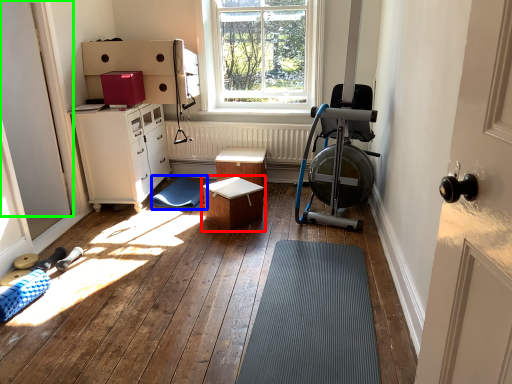
Question: Which object is positioned farthest from table (highlighted by a red box)? Select from mat (highlighted by a blue box) and door (highlighted by a green box).

Choices:
 (A) mat
 (B) door

Answer: (B)